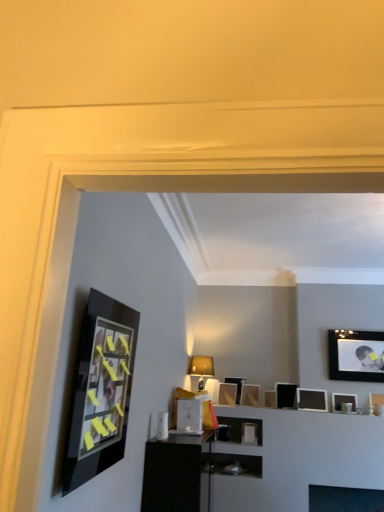
Question: In terms of width, does matte black picture frame at upper right, the first picture frame from the right, look wider or thinner when compared to matte black picture frame at center, which is counted as the seventh picture frame, starting from the right?

Choices:
 (A) wide
 (B) thin

Answer: (B)

Question: From the image's perspective, is matte black picture frame at upper right, which is counted as the ninth picture frame, starting from the left, positioned above or below matte black picture frame at center, which is counted as the third picture frame, starting from the back?

Choices:
 (A) above
 (B) below

Answer: (B)

Question: Which object is positioned farthest from the matte black picture frame at center, arranged as the third picture frame when viewed from the left?

Choices:
 (A) matte black picture frame at upper right, which appears as the 4th picture frame when viewed from the front
 (B) matte gold lampshade at center
 (C) matte black picture frame at upper right, placed as the fourth picture frame when sorted from back to front
 (D) matte black picture frame at left, which ranks as the 9th picture frame in right-to-left order
 (E) matte black picture frame at center, the 4th picture frame in the left-to-right sequence

Answer: (D)

Question: Which is nearer to the black glossy dresser at center?

Choices:
 (A) matte gold lampshade at center
 (B) matte black picture frame at center, positioned as the 6th picture frame in right-to-left order
 (C) matte black picture frame at center, which is counted as the third picture frame, starting from the back
 (D) metallic silver picture frame at center, acting as the eighth picture frame starting from the right
 (E) matte black picture frame at left, positioned as the 1th picture frame in front-to-back order

Answer: (D)